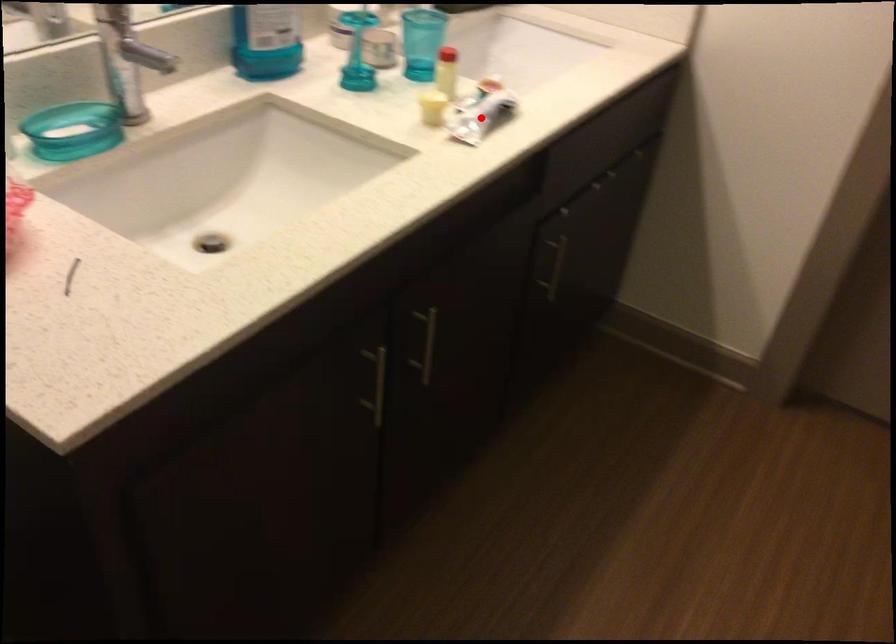
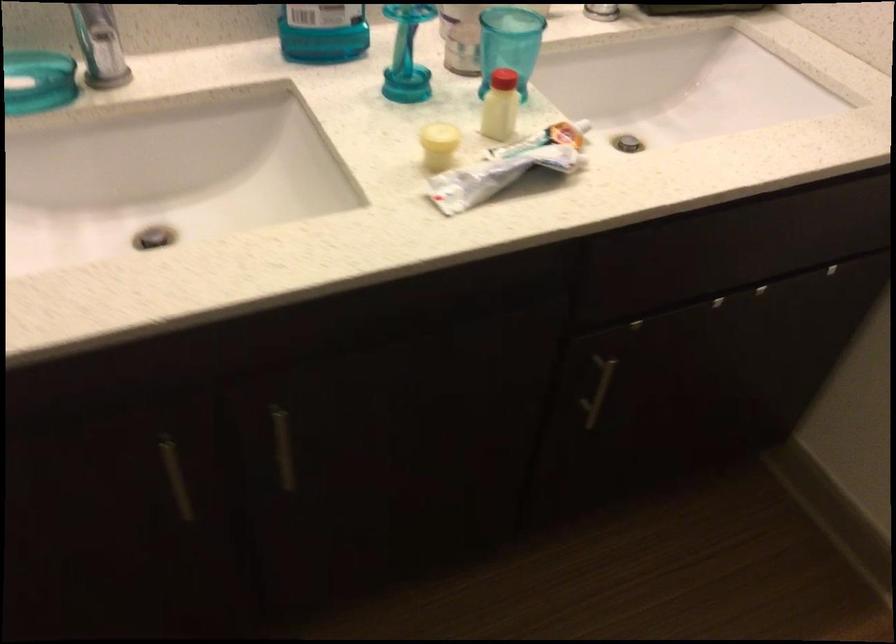
Question: I am providing you with two images of the same scene from different viewpoints. A red point is shown in image1. For the corresponding object point in image2, is it positioned nearer or farther from the camera?

Choices:
 (A) Nearer
 (B) Farther

Answer: (A)